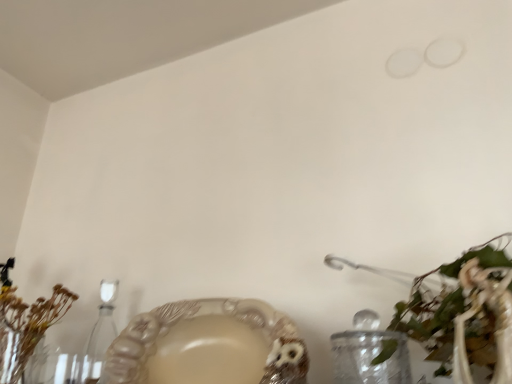
Question: Does clear glass candle holder at lower left come behind brown dried flowers at left, the 2th floral arrangement when ordered from right to left?

Choices:
 (A) yes
 (B) no

Answer: (A)

Question: Can you confirm if clear glass candle holder at lower left is wider than brown dried flowers at left, which is counted as the 1th floral arrangement, starting from the back?

Choices:
 (A) yes
 (B) no

Answer: (B)

Question: Would you say clear glass candle holder at lower left is outside brown dried flowers at left, which is counted as the 1th floral arrangement, starting from the back?

Choices:
 (A) yes
 (B) no

Answer: (A)

Question: Does clear glass candle holder at lower left turn towards brown dried flowers at left, which is the first floral arrangement in left-to-right order?

Choices:
 (A) no
 (B) yes

Answer: (A)

Question: From a real-world perspective, is clear glass candle holder at lower left over brown dried flowers at left, which is the first floral arrangement in left-to-right order?

Choices:
 (A) yes
 (B) no

Answer: (B)

Question: Considering the positions of clear glass candle holder at lower left and green leafy plant at lower right, the first floral arrangement positioned from the right, in the image, is clear glass candle holder at lower left wider or thinner than green leafy plant at lower right, the first floral arrangement positioned from the right,?

Choices:
 (A) wide
 (B) thin

Answer: (B)

Question: Is point (105, 294) positioned closer to the camera than point (422, 340)?

Choices:
 (A) farther
 (B) closer

Answer: (A)

Question: From a real-world perspective, is clear glass candle holder at lower left positioned above or below green leafy plant at lower right, the first floral arrangement positioned from the right?

Choices:
 (A) above
 (B) below

Answer: (A)

Question: Is clear glass candle holder at lower left bigger or smaller than green leafy plant at lower right, the 1th floral arrangement in the front-to-back sequence?

Choices:
 (A) small
 (B) big

Answer: (A)

Question: In terms of size, does green leafy plant at lower right, acting as the second floral arrangement starting from the left, appear bigger or smaller than brown dried flowers at left, the 2th floral arrangement when ordered from right to left?

Choices:
 (A) big
 (B) small

Answer: (B)

Question: From a real-world perspective, is green leafy plant at lower right, arranged as the 2th floral arrangement when viewed from the back, positioned above or below brown dried flowers at left, which is the first floral arrangement in left-to-right order?

Choices:
 (A) above
 (B) below

Answer: (B)

Question: Is green leafy plant at lower right, arranged as the 2th floral arrangement when viewed from the back, taller or shorter than brown dried flowers at left, marked as the second floral arrangement in a front-to-back arrangement?

Choices:
 (A) tall
 (B) short

Answer: (B)

Question: Does point coord(415,327) appear closer or farther from the camera than point coord(3,306)?

Choices:
 (A) farther
 (B) closer

Answer: (B)

Question: Is clear glass candle holder at lower left in front of or behind matte beige bowl at lower center in the image?

Choices:
 (A) front
 (B) behind

Answer: (B)

Question: From a real-world perspective, relative to matte beige bowl at lower center, is clear glass candle holder at lower left vertically above or below?

Choices:
 (A) above
 (B) below

Answer: (A)